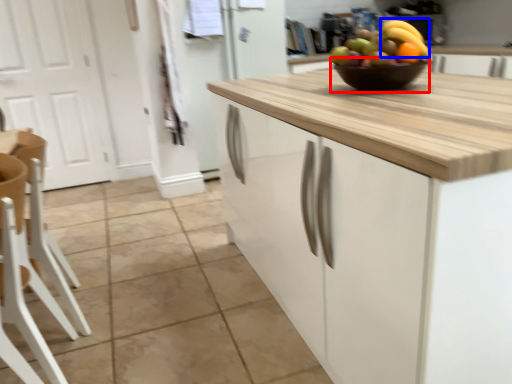
Question: Which of the following is the farthest to the observer, glass bowl (highlighted by a red box) or banana (highlighted by a blue box)?

Choices:
 (A) glass bowl
 (B) banana

Answer: (B)